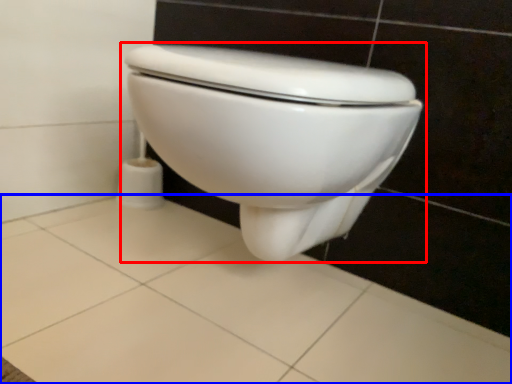
Question: Which of the following is the closest to the observer, toilet (highlighted by a red box) or ceramic tile (highlighted by a blue box)?

Choices:
 (A) toilet
 (B) ceramic tile

Answer: (B)